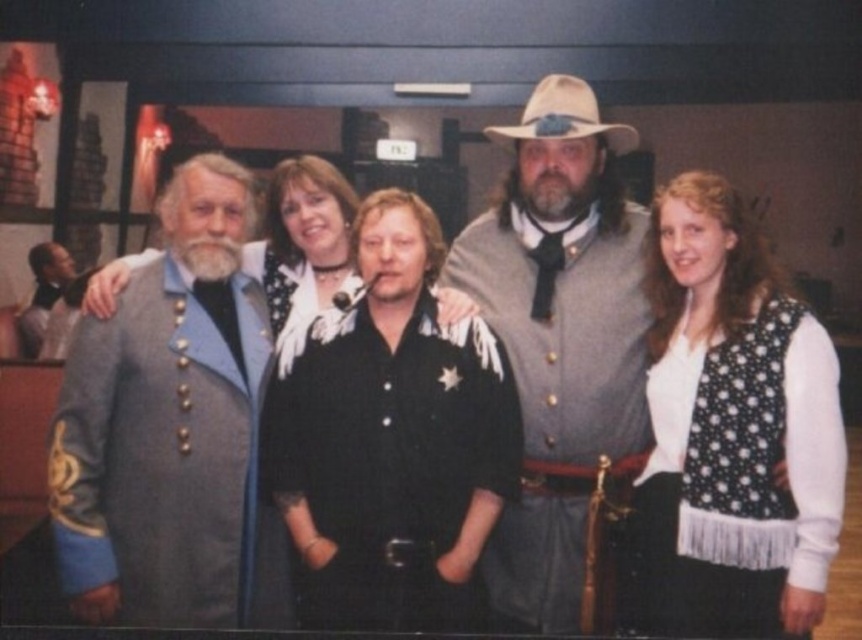
Is gray wool coat at left to the right of gray woolen coat at center from the viewer's perspective?

In fact, gray wool coat at left is to the left of gray woolen coat at center.

Does gray wool coat at left come in front of gray woolen coat at center?

Yes, gray wool coat at left is in front of gray woolen coat at center.

Which is in front, point (219, 461) or point (639, 378)?

Point (219, 461)

Find the location of a particular element. gray wool coat at left is located at coordinates (172, 429).

Between gray woolen coat at center and beige felt cowboy hat at center, which one appears on the right side from the viewer's perspective?

beige felt cowboy hat at center is more to the right.

Is gray woolen coat at center to the left of beige felt cowboy hat at center from the viewer's perspective?

Indeed, gray woolen coat at center is positioned on the left side of beige felt cowboy hat at center.

Locate an element on the screen. gray woolen coat at center is located at coordinates (560, 339).

Does gray wool coat at left lie behind beige felt cowboy hat at center?

No, it is in front of beige felt cowboy hat at center.

Is gray wool coat at left positioned before beige felt cowboy hat at center?

That is True.

Who is more forward, (233, 168) or (629, 131)?

Positioned in front is point (233, 168).

At what (x,y) coordinates should I click in order to perform the action: click on gray wool coat at left. Please return your answer as a coordinate pair (x, y). The width and height of the screenshot is (862, 640). Looking at the image, I should click on (172, 429).